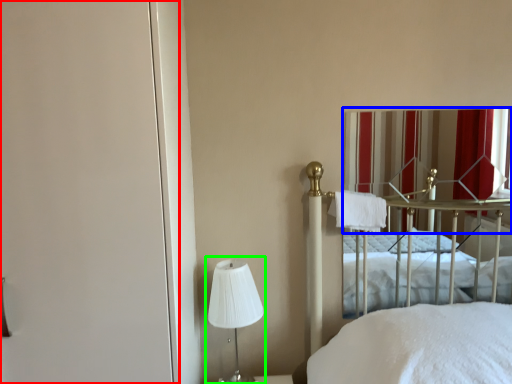
Question: Which is farther away from screen door (highlighted by a red box)? curtain (highlighted by a blue box) or bedside lamp (highlighted by a green box)?

Choices:
 (A) curtain
 (B) bedside lamp

Answer: (A)